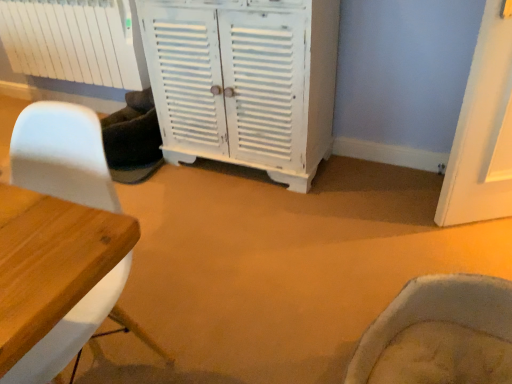
Question: Is white matte radiator at upper left wider or thinner than white painted wood cabinet at center?

Choices:
 (A) wide
 (B) thin

Answer: (B)

Question: In the image, is white matte radiator at upper left positioned in front of or behind white painted wood cabinet at center?

Choices:
 (A) front
 (B) behind

Answer: (B)

Question: Which object is positioned farthest from the white matte radiator at upper left?

Choices:
 (A) white painted wood cabinet at center
 (B) white matte chair at left

Answer: (B)

Question: Which object is positioned farthest from the white painted wood cabinet at center?

Choices:
 (A) white matte chair at left
 (B) white matte radiator at upper left

Answer: (A)